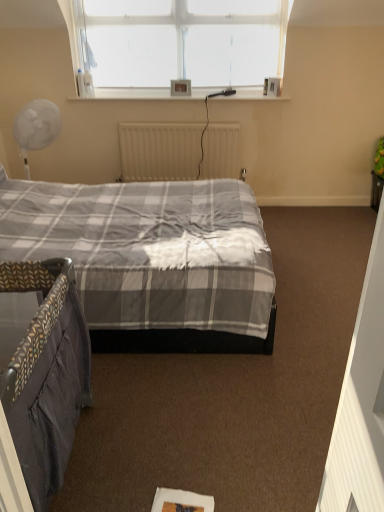
Question: Can white matte radiator at center be found inside dark grey fabric crib at lower left?

Choices:
 (A) no
 (B) yes

Answer: (A)

Question: Is dark grey fabric crib at lower left looking in the opposite direction of white matte radiator at center?

Choices:
 (A) yes
 (B) no

Answer: (B)

Question: Does dark grey fabric crib at lower left have a lesser height compared to white matte radiator at center?

Choices:
 (A) yes
 (B) no

Answer: (B)

Question: Is dark grey fabric crib at lower left to the right of white matte radiator at center from the viewer's perspective?

Choices:
 (A) yes
 (B) no

Answer: (B)

Question: Is dark grey fabric crib at lower left behind white matte radiator at center?

Choices:
 (A) yes
 (B) no

Answer: (B)

Question: Based on their sizes in the image, would you say white matte radiator at center is bigger or smaller than matte plastic picture frame at upper center?

Choices:
 (A) big
 (B) small

Answer: (A)

Question: From a real-world perspective, relative to matte plastic picture frame at upper center, is white matte radiator at center vertically above or below?

Choices:
 (A) above
 (B) below

Answer: (B)

Question: Is white matte radiator at center inside or outside of matte plastic picture frame at upper center?

Choices:
 (A) outside
 (B) inside

Answer: (A)

Question: In the image, is white matte radiator at center positioned in front of or behind matte plastic picture frame at upper center?

Choices:
 (A) behind
 (B) front

Answer: (A)

Question: Is dark grey fabric crib at lower left wider or thinner than white matte radiator at center?

Choices:
 (A) thin
 (B) wide

Answer: (B)

Question: From a real-world perspective, is dark grey fabric crib at lower left positioned above or below white matte radiator at center?

Choices:
 (A) above
 (B) below

Answer: (B)

Question: Is dark grey fabric crib at lower left in front of or behind white matte radiator at center in the image?

Choices:
 (A) behind
 (B) front

Answer: (B)

Question: Is dark grey fabric crib at lower left inside or outside of white matte radiator at center?

Choices:
 (A) outside
 (B) inside

Answer: (A)

Question: From a real-world perspective, is matte plastic picture frame at upper center above or below dark grey fabric crib at lower left?

Choices:
 (A) above
 (B) below

Answer: (A)

Question: Looking at the image, does matte plastic picture frame at upper center seem bigger or smaller compared to dark grey fabric crib at lower left?

Choices:
 (A) big
 (B) small

Answer: (B)